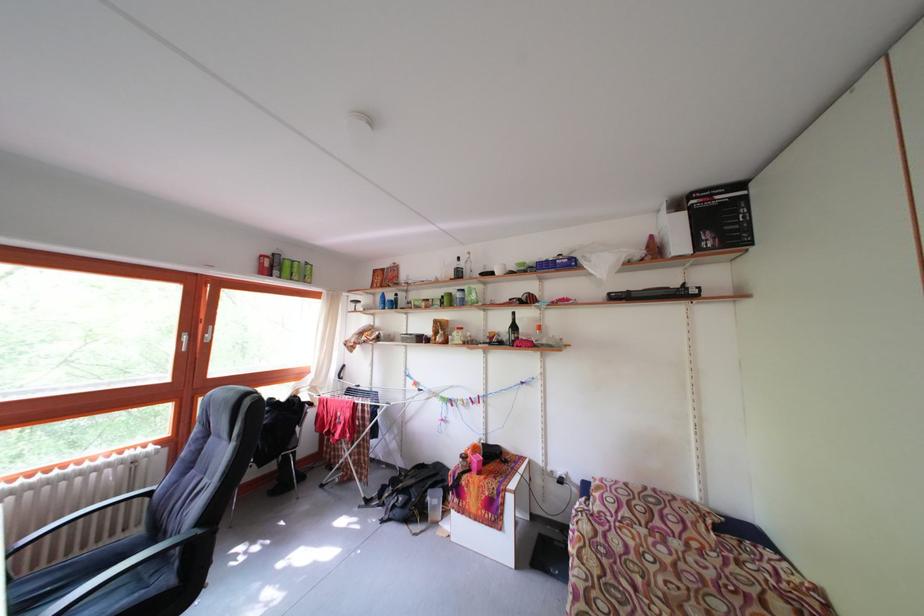
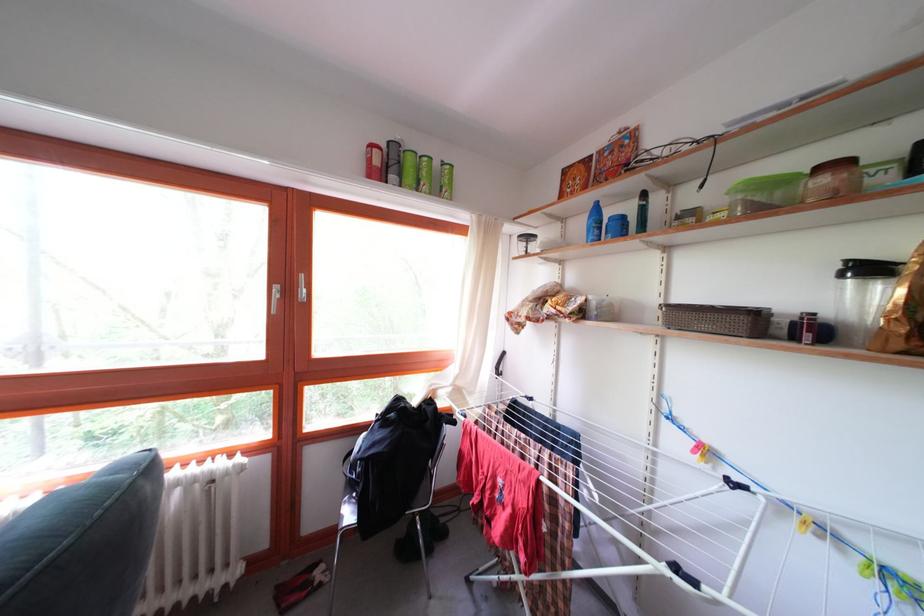
Find the pixel in the second image that matches pixel 289 277 in the first image.

(409, 180)